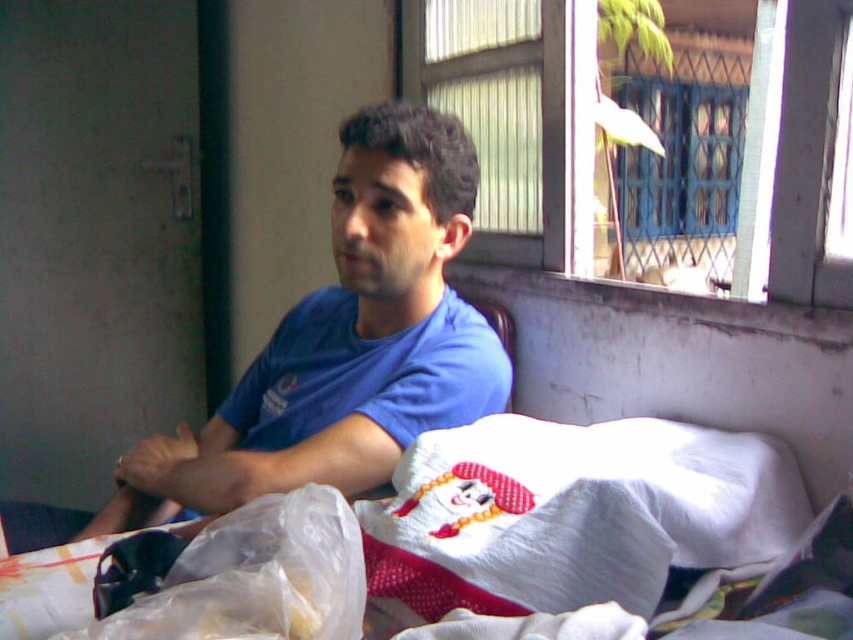
Question: Does white cotton bed at center appear under white cotton pillow at lower center?

Choices:
 (A) yes
 (B) no

Answer: (A)

Question: Which object appears closest to the camera in this image?

Choices:
 (A) white cotton bed at center
 (B) blue cotton shirt at center

Answer: (A)

Question: Estimate the real-world distances between objects in this image. Which object is closer to the blue cotton shirt at center?

Choices:
 (A) white cotton bed at center
 (B) white cotton pillow at lower center

Answer: (A)

Question: Considering the relative positions of blue cotton shirt at center and white cotton pillow at lower center in the image provided, where is blue cotton shirt at center located with respect to white cotton pillow at lower center?

Choices:
 (A) above
 (B) below

Answer: (A)

Question: Which is nearer to the blue cotton shirt at center?

Choices:
 (A) white cotton pillow at lower center
 (B) white cotton bed at center

Answer: (B)

Question: Is white cotton bed at center positioned before white cotton pillow at lower center?

Choices:
 (A) yes
 (B) no

Answer: (A)